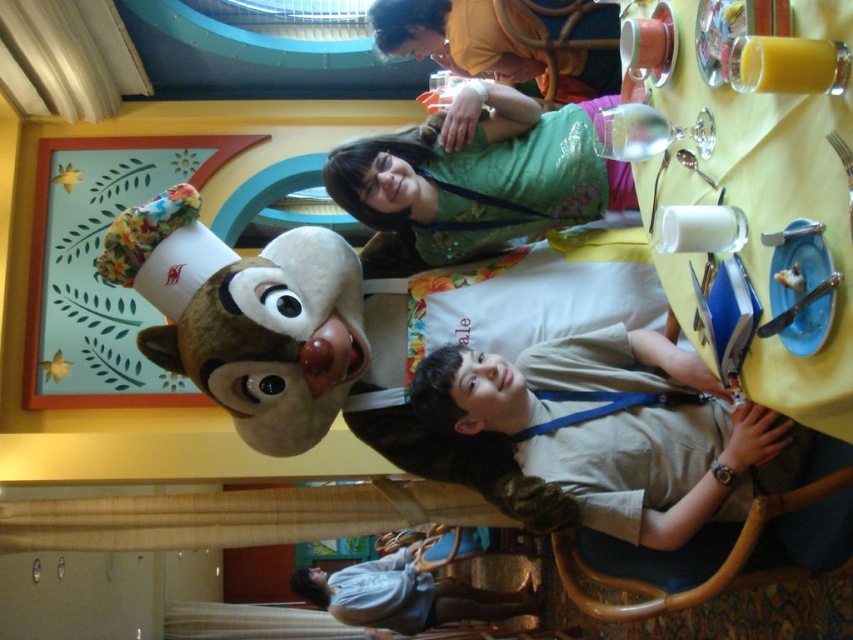
Question: Observing the image, what is the correct spatial positioning of light brown uniform at center in reference to green fabric shirt at upper center?

Choices:
 (A) left
 (B) right

Answer: (B)

Question: Is fluffy brown plush toy at upper left below green fabric shirt at upper center?

Choices:
 (A) no
 (B) yes

Answer: (B)

Question: Which object is farther from the camera taking this photo?

Choices:
 (A) fluffy brown plush toy at upper left
 (B) denim shirt at lower center
 (C) light brown uniform at center

Answer: (B)

Question: Is green fabric shirt at upper center thinner than denim shirt at lower center?

Choices:
 (A) no
 (B) yes

Answer: (A)

Question: Which of the following is the farthest from the observer?

Choices:
 (A) (421, 202)
 (B) (363, 570)

Answer: (B)

Question: Considering the real-world distances, which object is farthest from the green fabric shirt at upper center?

Choices:
 (A) fluffy brown plush toy at upper left
 (B) light brown uniform at center

Answer: (B)